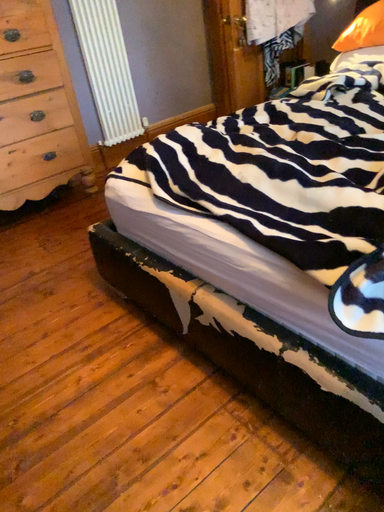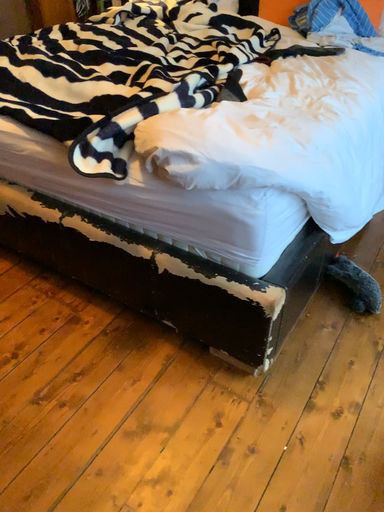
Question: Which way did the camera rotate in the video?

Choices:
 (A) rotated left
 (B) rotated right

Answer: (B)